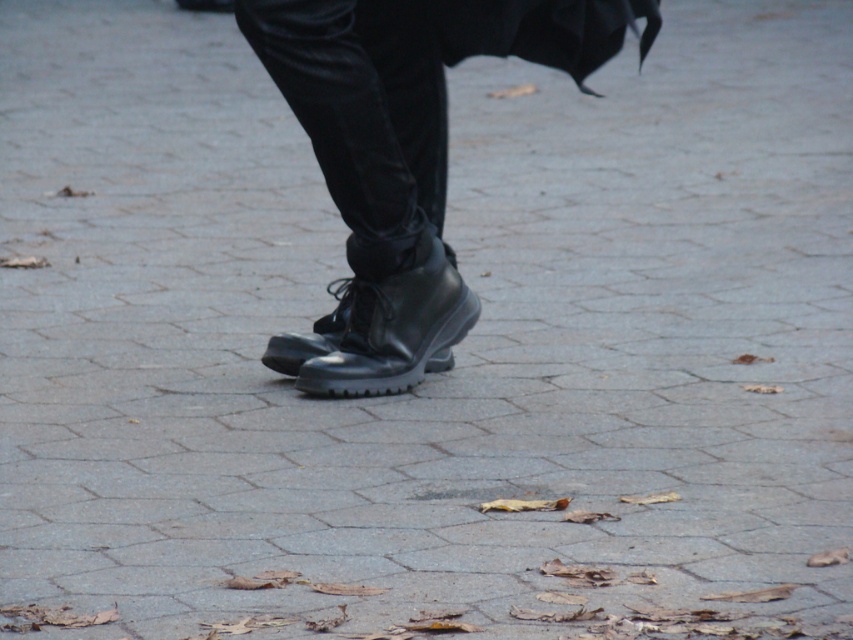
Question: Is shiny black boots at center positioned at the back of black leather boot at center?

Choices:
 (A) yes
 (B) no

Answer: (B)

Question: Does shiny black boots at center appear under black leather boot at center?

Choices:
 (A) no
 (B) yes

Answer: (A)

Question: Among these objects, which one is nearest to the camera?

Choices:
 (A) shiny black boots at center
 (B) black leather boot at center

Answer: (A)

Question: Can you confirm if shiny black boots at center is positioned to the left of black leather boot at center?

Choices:
 (A) yes
 (B) no

Answer: (B)